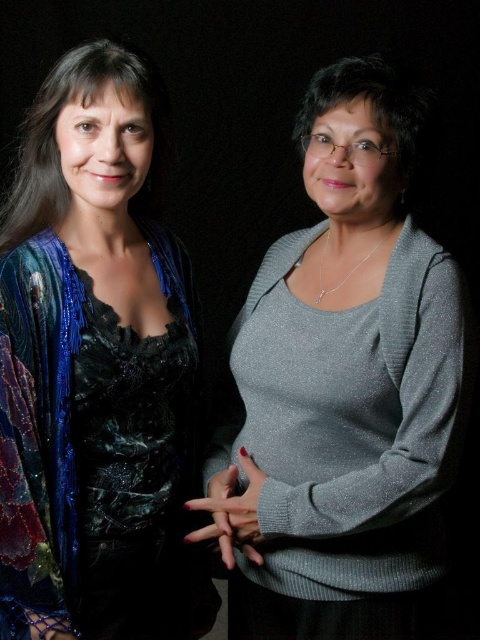
Is shiny silver sweater at center taller than shiny blue sequined jacket at left?

Incorrect, shiny silver sweater at center's height is not larger of shiny blue sequined jacket at left's.

The width and height of the screenshot is (480, 640). I want to click on shiny silver sweater at center, so click(345, 385).

Between point (339, 392) and point (151, 280), which one is positioned in front?

Point (339, 392) is in front.

Find the location of a particular element. shiny silver sweater at center is located at coordinates (345, 385).